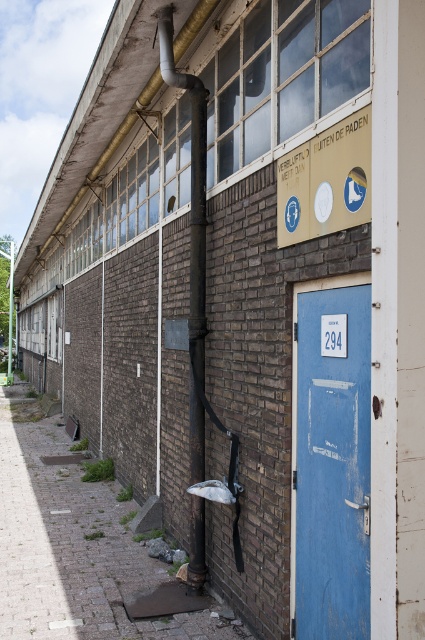
Between brick wall at center and yellow matte sign at upper center, which one appears on the right side from the viewer's perspective?

yellow matte sign at upper center

Looking at this image, between brick wall at center and yellow matte sign at upper center, which one has less height?

brick wall at center

Measure the distance between brick wall at center and camera.

brick wall at center is 4.85 meters away from camera.

The width and height of the screenshot is (425, 640). I want to click on brick wall at center, so click(74, 547).

Is blue matte door at center shorter than yellow matte sign at upper center?

In fact, blue matte door at center may be taller than yellow matte sign at upper center.

Is blue matte door at center positioned at the back of yellow matte sign at upper center?

No, blue matte door at center is in front of yellow matte sign at upper center.

Who is more distant from viewer, (297, 388) or (305, 172)?

The point (297, 388) is behind.

You are a GUI agent. You are given a task and a screenshot of the screen. Output one action in this format:
    pyautogui.click(x=<x>, y=<y>)
    Task: Click on the blue matte door at center
    
    Given the screenshot: What is the action you would take?
    pyautogui.click(x=331, y=464)

Who is higher up, brick wall at center or blue matte door at center?

Positioned higher is blue matte door at center.

Which of these two, brick wall at center or blue matte door at center, stands taller?

blue matte door at center

Describe the element at coordinates (74, 547) in the screenshot. I see `brick wall at center` at that location.

Locate an element on the screen. This screenshot has height=640, width=425. brick wall at center is located at coordinates (74, 547).